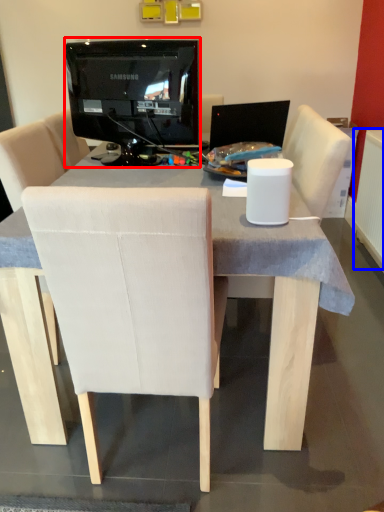
Question: Among these objects, which one is farthest to the camera, television (highlighted by a red box) or radiator (highlighted by a blue box)?

Choices:
 (A) television
 (B) radiator

Answer: (B)